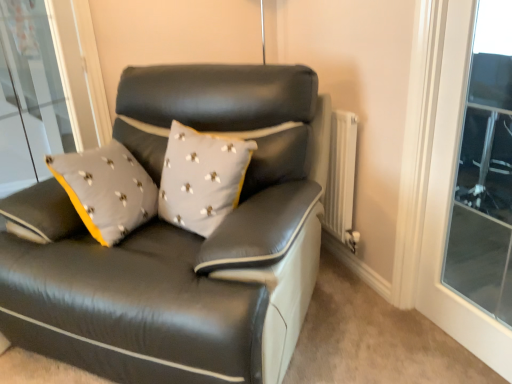
Question: From the image's perspective, is white textured radiator at right above or below transparent glass window at upper right?

Choices:
 (A) above
 (B) below

Answer: (A)

Question: From a real-world perspective, is white textured radiator at right above or below transparent glass window at upper right?

Choices:
 (A) below
 (B) above

Answer: (A)

Question: Considering the real-world distances, which object is farthest from the matte black leather couch at center?

Choices:
 (A) transparent glass window at upper right
 (B) white textured radiator at right

Answer: (A)

Question: Which of these objects is positioned closest to the matte black leather couch at center?

Choices:
 (A) transparent glass window at upper right
 (B) white textured radiator at right

Answer: (B)